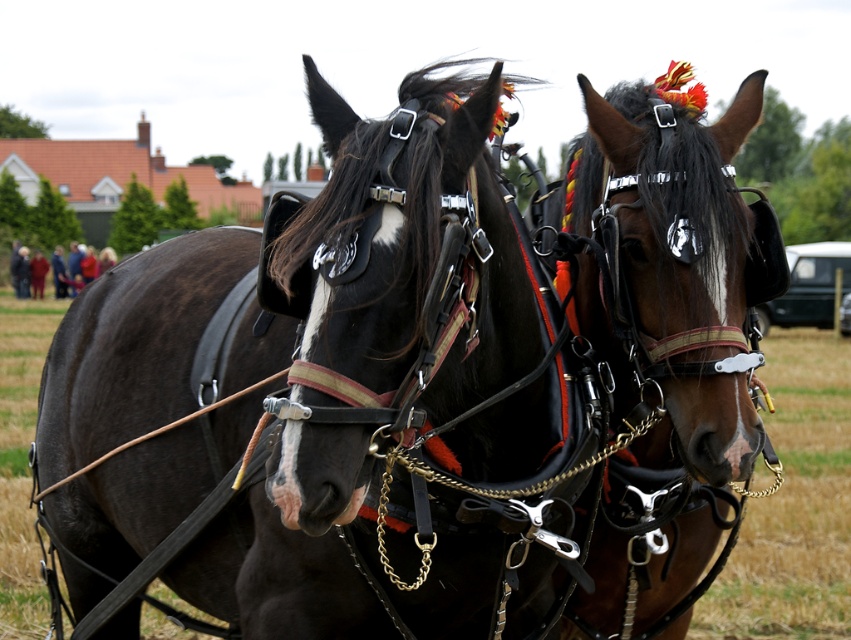
Is shiny black harness at center in front of red wool coat at left?

That is True.

Based on the photo, can you confirm if shiny black harness at center is wider than red wool coat at left?

Incorrect, shiny black harness at center's width does not surpass red wool coat at left's.

Does point (44, 497) come closer to viewer compared to point (93, 276)?

That is True.

Find the location of `shiny black harness at center`. shiny black harness at center is located at coordinates (363, 387).

What are the coordinates of `shiny black harness at center` in the screenshot? It's located at (363, 387).

This screenshot has width=851, height=640. What do you see at coordinates (363, 387) in the screenshot?
I see `shiny black harness at center` at bounding box center [363, 387].

At what (x,y) coordinates should I click in order to perform the action: click on shiny black harness at center. Please return your answer as a coordinate pair (x, y). Looking at the image, I should click on (363, 387).

Which is above, shiny brown horse at center or red wool coat at left?

Positioned higher is red wool coat at left.

Can you confirm if shiny brown horse at center is thinner than red wool coat at left?

Indeed, shiny brown horse at center has a lesser width compared to red wool coat at left.

Is point (677, 305) more distant than point (21, 296)?

No, (677, 305) is closer to viewer.

Find the location of a particular element. shiny brown horse at center is located at coordinates 667,324.